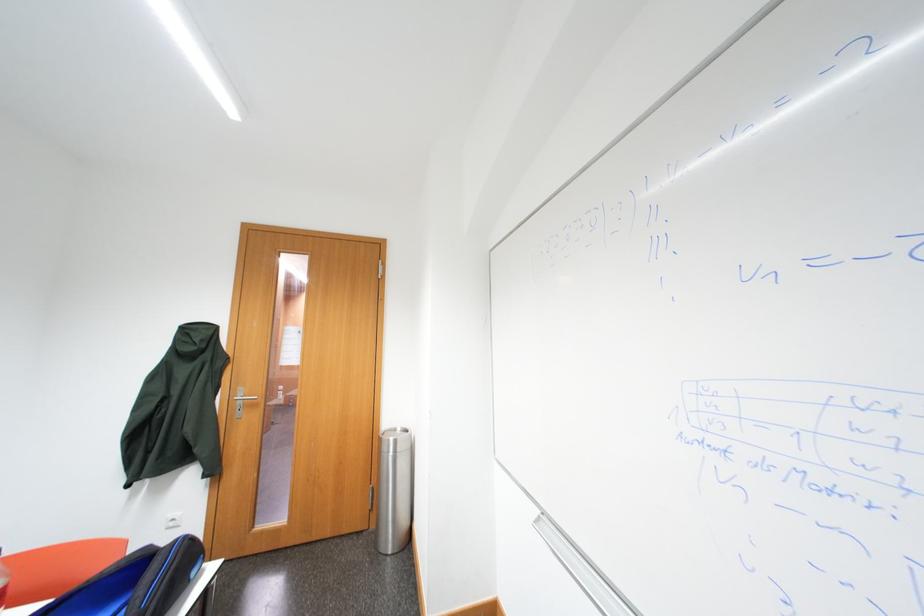
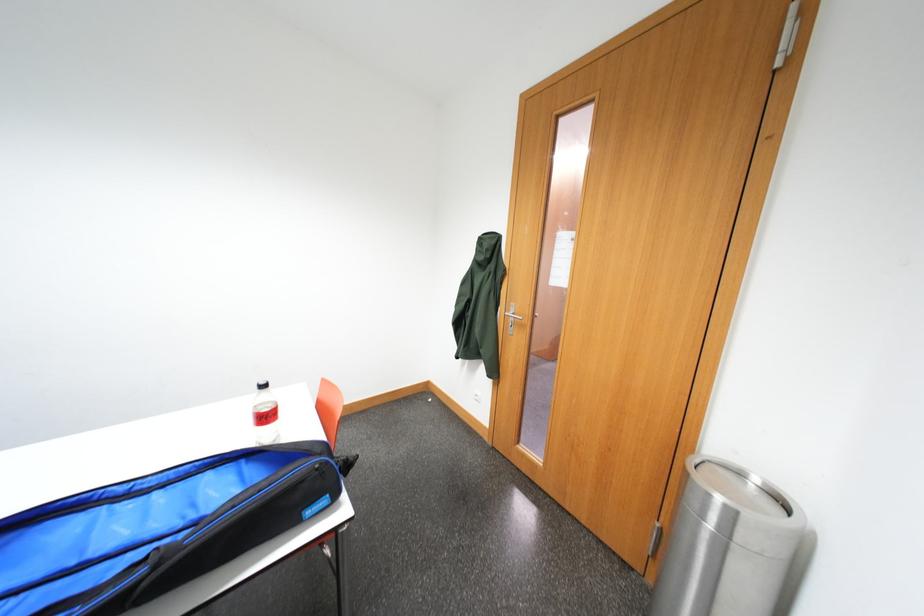
Question: Based on the continuous images, in which direction is the camera rotating? Reply with the corresponding letter.

Choices:
 (A) Left
 (B) Right
 (C) Up
 (D) Down

Answer: (A)